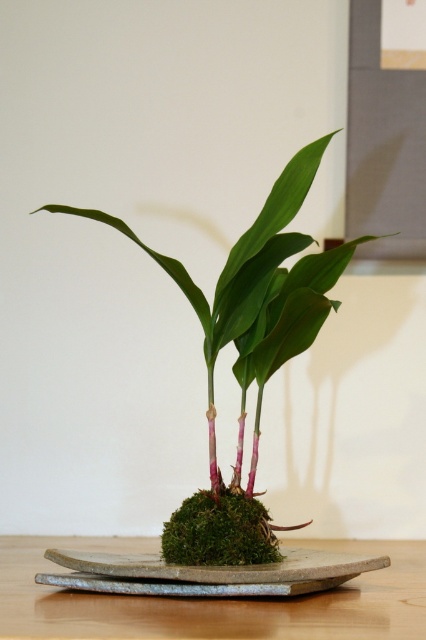
Does green moss at center have a smaller size compared to gray stone tray at center?

No, green moss at center is not smaller than gray stone tray at center.

From the picture: Between green moss at center and gray stone tray at center, which one is positioned higher?

Positioned higher is gray stone tray at center.

Measure the distance between point (396, 584) and camera.

Point (396, 584) is 90.22 centimeters from camera.

At what (x,y) coordinates should I click in order to perform the action: click on green moss at center. Please return your answer as a coordinate pair (x, y). This screenshot has height=640, width=426. Looking at the image, I should click on (212, 600).

Does point (238, 560) come in front of point (106, 566)?

No, (238, 560) is behind (106, 566).

Can you confirm if green mossy plant at center is thinner than gray stone tray at center?

Correct, green mossy plant at center's width is less than gray stone tray at center's.

Is point (247, 301) farther from camera compared to point (259, 588)?

Yes, it is.

You are a GUI agent. You are given a task and a screenshot of the screen. Output one action in this format:
    pyautogui.click(x=<x>, y=<y>)
    Task: Click on the green mossy plant at center
    
    Given the screenshot: What is the action you would take?
    pyautogui.click(x=249, y=353)

Find the location of a particular element. green mossy plant at center is located at coordinates (249, 353).

Which is behind, point (169, 531) or point (169, 614)?

Positioned behind is point (169, 531).

Which is in front, point (80, 211) or point (379, 630)?

Point (379, 630) is in front.

Locate an element on the screen. green mossy plant at center is located at coordinates (249, 353).